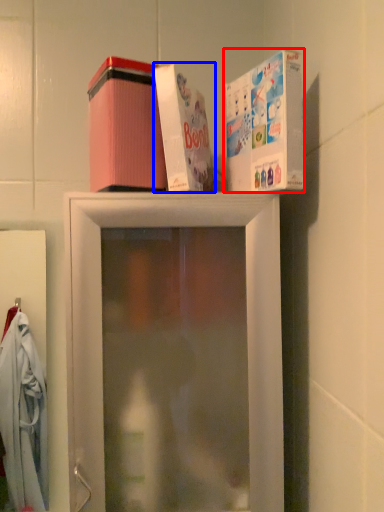
Question: Which of the following is the closest to the observer, box (highlighted by a red box) or box (highlighted by a blue box)?

Choices:
 (A) box
 (B) box

Answer: (A)